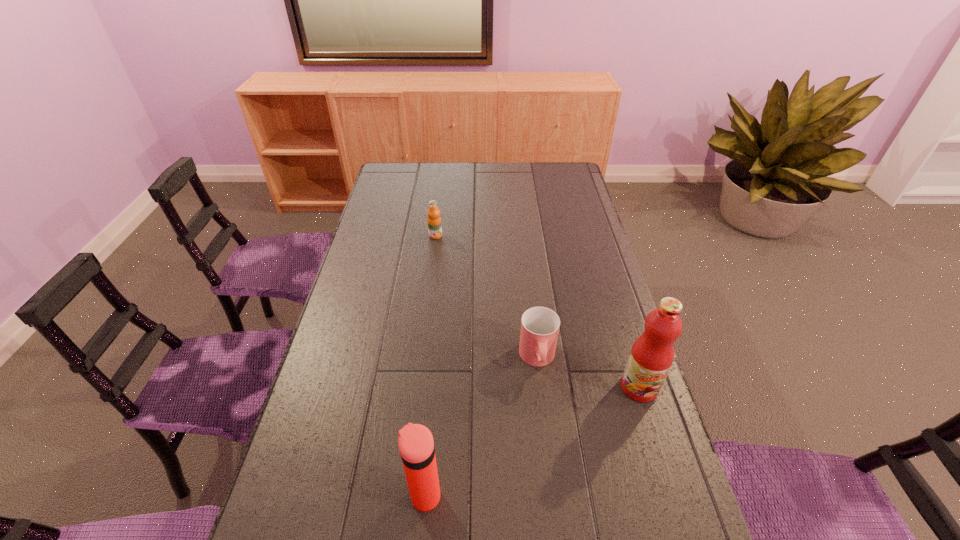
This screenshot has height=540, width=960. In the image, there is a desktop. Find the location of `vacant area at the far right corner`. vacant area at the far right corner is located at coordinates (561, 181).

Locate an element on the screen. The height and width of the screenshot is (540, 960). vacant space that's between the tallest object and the cup is located at coordinates (588, 373).

Image resolution: width=960 pixels, height=540 pixels. In order to click on free space between the third shortest object and the third object from left to right in this screenshot , I will do tap(481, 427).

You are a GUI agent. You are given a task and a screenshot of the screen. Output one action in this format:
    pyautogui.click(x=<x>, y=<y>)
    Task: Click on the free space that is in between the cup and the rightmost object
    
    Given the screenshot: What is the action you would take?
    pyautogui.click(x=588, y=373)

Find the location of `vacant space that's between the second tallest object and the farthest object`. vacant space that's between the second tallest object and the farthest object is located at coordinates (430, 366).

Locate an element on the screen. This screenshot has width=960, height=540. free area in between the cup and the rightmost object is located at coordinates (588, 373).

Where is `free space between the orange juice and the cup`? free space between the orange juice and the cup is located at coordinates (487, 297).

Image resolution: width=960 pixels, height=540 pixels. In order to click on empty location between the second object from right to left and the orange juice in this screenshot , I will do `click(487, 297)`.

Locate an element on the screen. The height and width of the screenshot is (540, 960). vacant area that lies between the thermos bottle and the orange juice is located at coordinates (430, 366).

Identify the location of free spot between the nearest object and the second object from right to left. pyautogui.click(x=481, y=427).